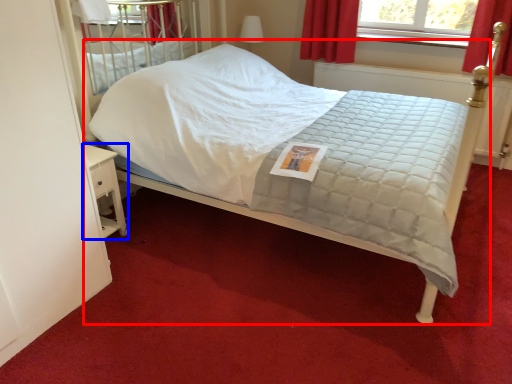
Question: Which object is further to the camera taking this photo, bed (highlighted by a red box) or nightstand (highlighted by a blue box)?

Choices:
 (A) bed
 (B) nightstand

Answer: (B)